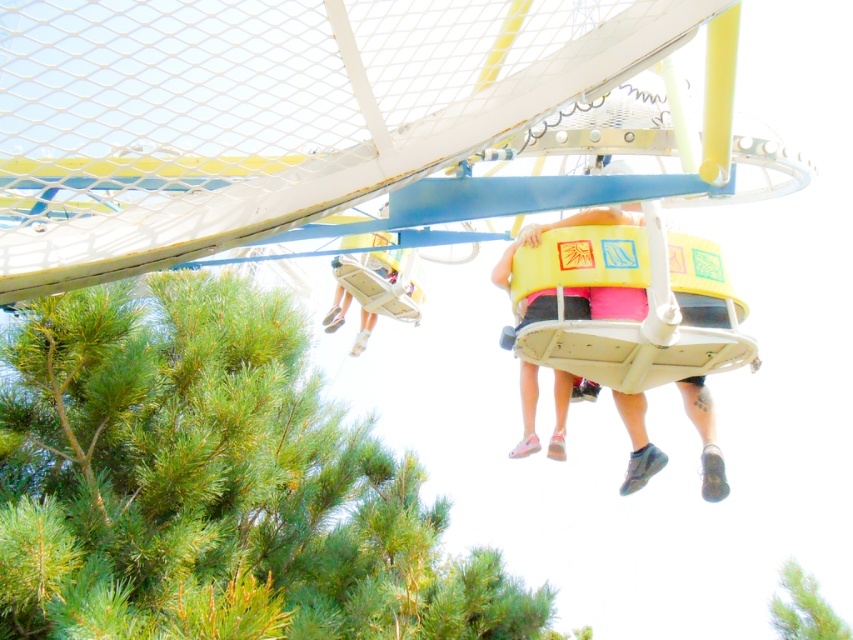
You are standing at the base of the amusement ride and see the green leafy tree at lower left and the yellow plastic bucket at center. Which object is closer to you?

The green leafy tree at lower left is closer to you because it is in front of the yellow plastic bucket at center.

You are standing at the base of the amusement ride and want to place a 5 meter long ladder between the green leafy tree at lower left and the yellow plastic bucket at center. Will the ladder fit horizontally between them?

The green leafy tree at lower left is 5.48 meters from the yellow plastic bucket at center. Since the ladder is 5 meters long, it will fit horizontally between them as the distance is slightly longer than the ladder.

You are standing at the base of the amusement ride and want to take a photo of the yellow matte seat at center without the green leafy tree at lower left blocking the view. Is the tree in the way?

The green leafy tree at lower left is located below the yellow matte seat at center, so the tree is below the seat and not blocking the view. You can take the photo without the tree obstructing the seat.